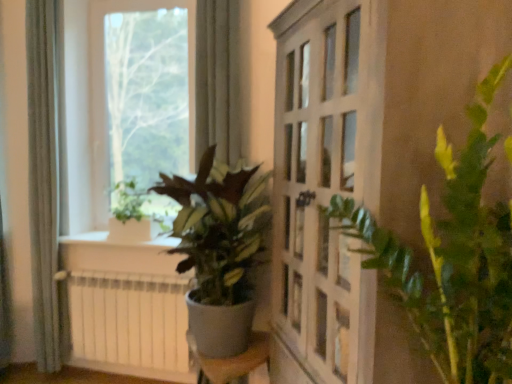
Question: From a real-world perspective, is white glossy window sill at lower left physically above gray fabric curtain at left?

Choices:
 (A) yes
 (B) no

Answer: (B)

Question: Is white glossy window sill at lower left wider than gray fabric curtain at left?

Choices:
 (A) no
 (B) yes

Answer: (B)

Question: Can you confirm if white glossy window sill at lower left is thinner than gray fabric curtain at left?

Choices:
 (A) yes
 (B) no

Answer: (B)

Question: From a real-world perspective, is white glossy window sill at lower left positioned under gray fabric curtain at left based on gravity?

Choices:
 (A) no
 (B) yes

Answer: (B)

Question: Is white glossy window sill at lower left in front of gray fabric curtain at left?

Choices:
 (A) no
 (B) yes

Answer: (A)

Question: Can you confirm if white glossy window sill at lower left is positioned to the left of gray fabric curtain at left?

Choices:
 (A) yes
 (B) no

Answer: (B)

Question: Considering the relative sizes of white glossy window sill at lower left and white matte radiator at lower left in the image provided, is white glossy window sill at lower left bigger than white matte radiator at lower left?

Choices:
 (A) no
 (B) yes

Answer: (A)

Question: From a real-world perspective, is white glossy window sill at lower left under white matte radiator at lower left?

Choices:
 (A) no
 (B) yes

Answer: (A)

Question: Is white glossy window sill at lower left to the left of white matte radiator at lower left from the viewer's perspective?

Choices:
 (A) no
 (B) yes

Answer: (B)

Question: Is the position of white glossy window sill at lower left more distant than that of white matte radiator at lower left?

Choices:
 (A) yes
 (B) no

Answer: (A)

Question: Is white matte radiator at lower left completely or partially inside white glossy window sill at lower left?

Choices:
 (A) yes
 (B) no

Answer: (B)

Question: Can you confirm if white glossy window sill at lower left is positioned to the right of white matte radiator at lower left?

Choices:
 (A) no
 (B) yes

Answer: (A)

Question: From a real-world perspective, is green matte plant at center, the second houseplant positioned from the front, beneath gray fabric curtain at left?

Choices:
 (A) yes
 (B) no

Answer: (A)